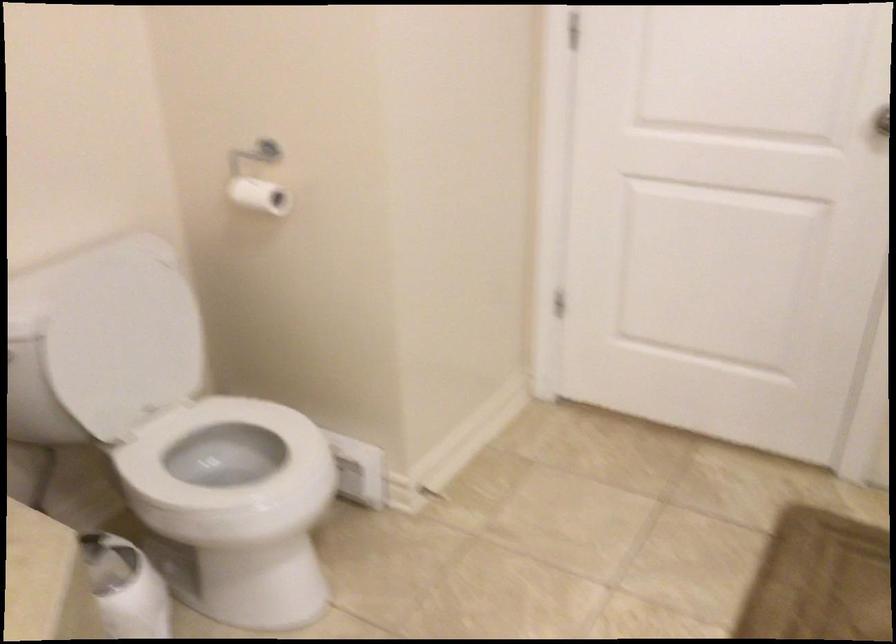
This screenshot has height=644, width=896. What do you see at coordinates (259, 194) in the screenshot?
I see `a toilet paper roll` at bounding box center [259, 194].